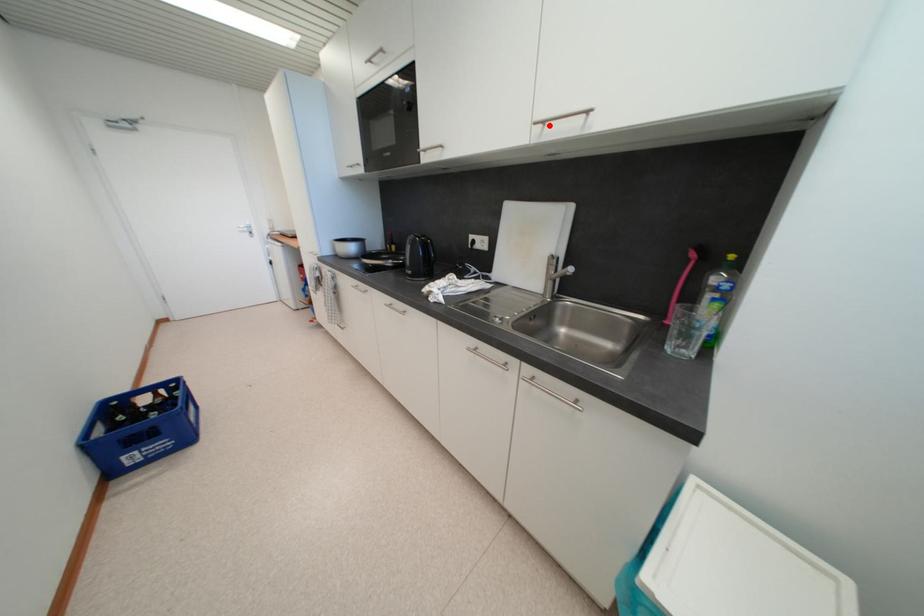
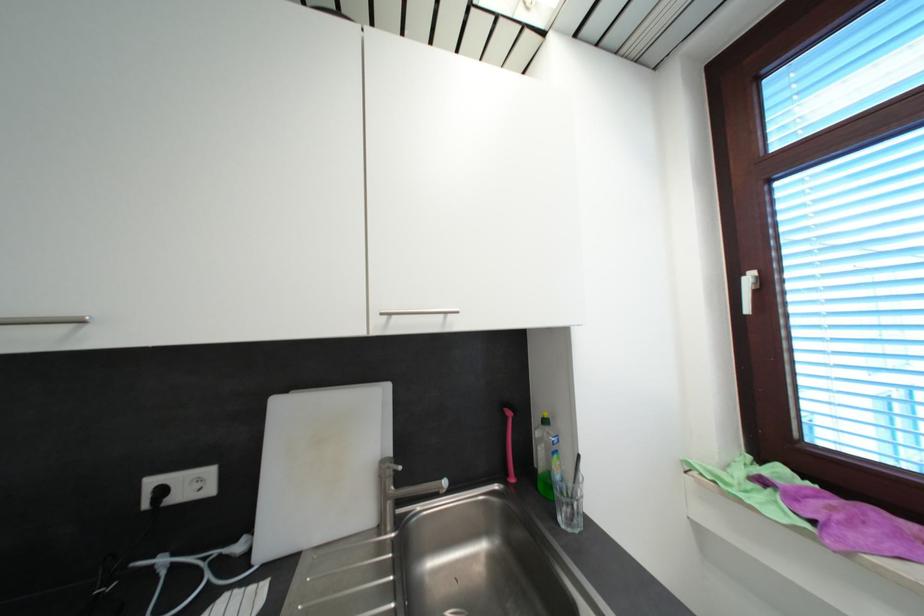
Locate, in the second image, the point that corresponds to the highlighted location in the first image.

(395, 315)